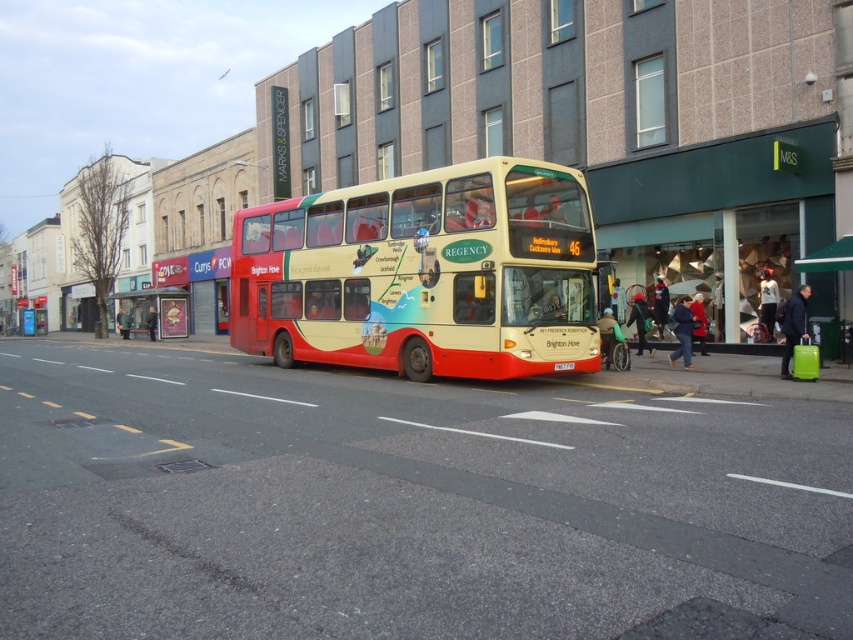
Is metallic silver bus stop at center wider than white plastic license plate at center?

Yes.

Consider the image. Does metallic silver bus stop at center have a larger size compared to white plastic license plate at center?

Yes, metallic silver bus stop at center is bigger than white plastic license plate at center.

Which is in front, point (177, 300) or point (561, 364)?

Point (561, 364)

Where is `metallic silver bus stop at center`? metallic silver bus stop at center is located at coordinates (152, 312).

What do you see at coordinates (422, 273) in the screenshot? The width and height of the screenshot is (853, 640). I see `beige glossy double-decker bus at center` at bounding box center [422, 273].

The height and width of the screenshot is (640, 853). In order to click on beige glossy double-decker bus at center in this screenshot , I will do `click(422, 273)`.

Does beige glossy double-decker bus at center have a larger size compared to white plastic license plate at center?

Yes, beige glossy double-decker bus at center is bigger than white plastic license plate at center.

Does beige glossy double-decker bus at center have a smaller size compared to white plastic license plate at center?

Actually, beige glossy double-decker bus at center might be larger than white plastic license plate at center.

Image resolution: width=853 pixels, height=640 pixels. What do you see at coordinates (422, 273) in the screenshot? I see `beige glossy double-decker bus at center` at bounding box center [422, 273].

Where is `beige glossy double-decker bus at center`? This screenshot has height=640, width=853. beige glossy double-decker bus at center is located at coordinates (422, 273).